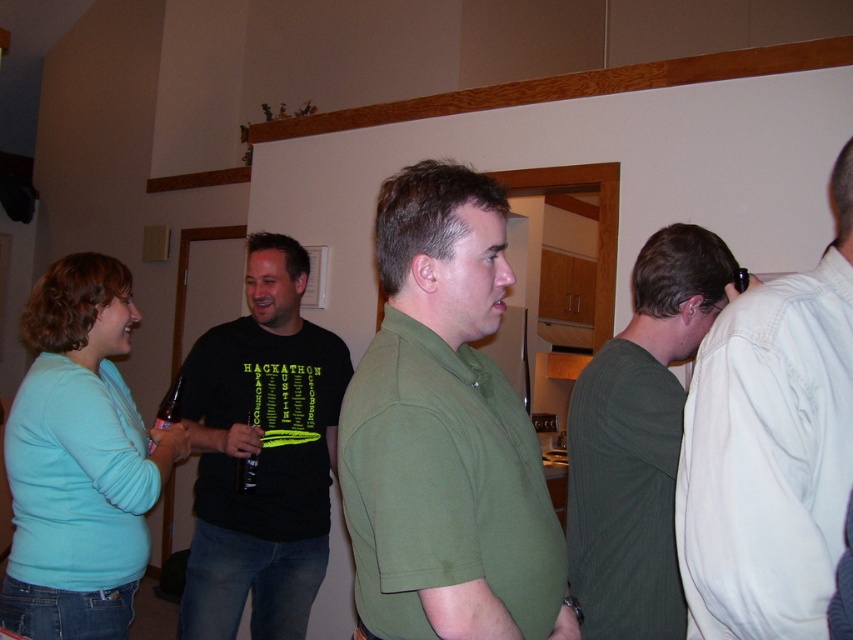
Question: Which object appears farthest from the camera in this image?

Choices:
 (A) green matte shirt at center
 (B) white cotton shirt at right
 (C) black cotton t-shirt at center
 (D) dark green sweater at center

Answer: (C)

Question: Observing the image, what is the correct spatial positioning of green matte shirt at center in reference to black cotton t-shirt at center?

Choices:
 (A) left
 (B) right

Answer: (B)

Question: Does black cotton t-shirt at center lie behind dark green sweater at center?

Choices:
 (A) yes
 (B) no

Answer: (A)

Question: Which point appears closest to the camera in this image?

Choices:
 (A) [265, 589]
 (B) [735, 381]
 (C) [438, 385]

Answer: (B)

Question: Estimate the real-world distances between objects in this image. Which object is farther from the black cotton t-shirt at center?

Choices:
 (A) white cotton shirt at right
 (B) green matte shirt at center

Answer: (A)

Question: Is black cotton t-shirt at center wider than dark green sweater at center?

Choices:
 (A) yes
 (B) no

Answer: (A)